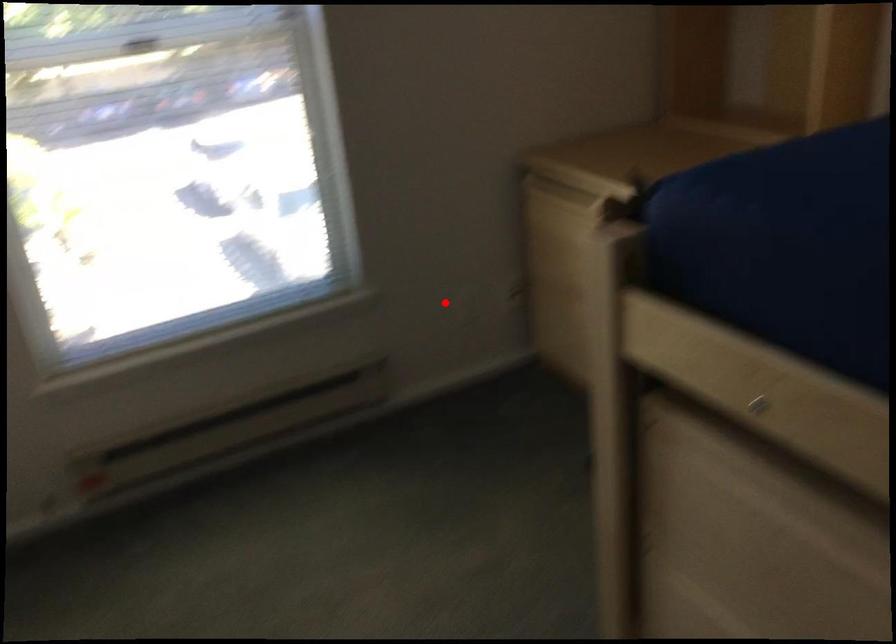
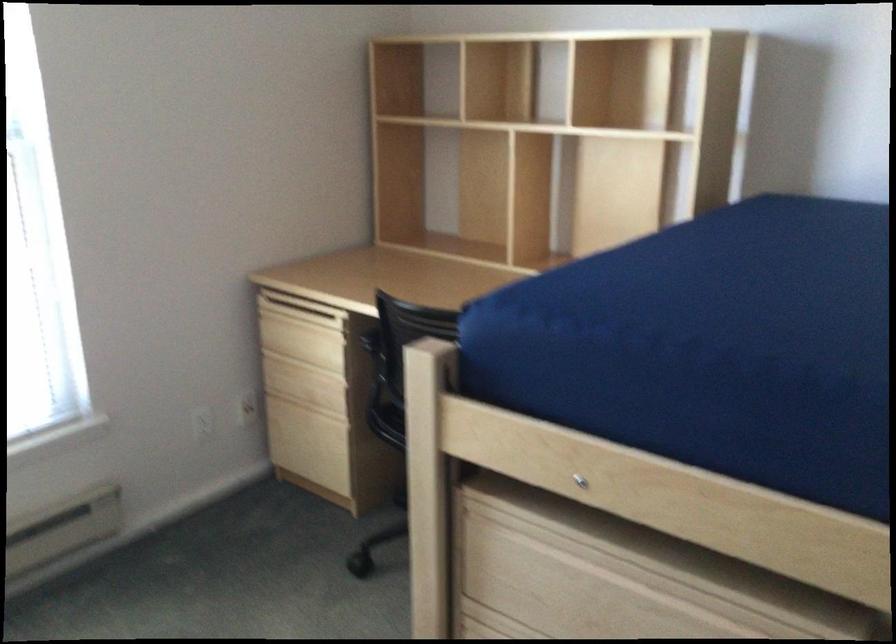
Where in the second image is the point corresponding to the highlighted location from the first image?

(185, 424)